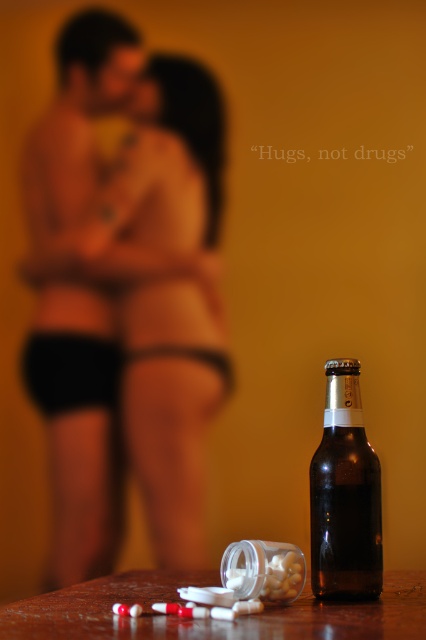
You are a photographer adjusting your camera settings to capture the scene. You notice the matte black man at center and the wooden table at lower center. Which object is positioned higher in the frame?

The matte black man at center is located above the wooden table at lower center, so he is positioned higher in the frame.

You are a photographer standing at a distance of 25 inches from the matte black man at center. Can you capture his face clearly in your photo?

The matte black man at center is 25.64 inches away from the camera. Since you are standing at 25 inches, you are slightly closer than the man, so you can capture his face clearly.

You are holding a camera and want to take a photo of the scene. The camera is currently at a position that is 17.27 inches away from the point labeled as point (351, 625). To ensure the entire scene is in focus, you need to adjust the camera so that it is exactly 20 inches away from this point. How much further do you need to move the camera away from the point to achieve this?

You need to move the camera 2.73 inches further away from the point (351, 625) to reach the desired distance of 20 inches. The current distance is 17.27 inches, so subtracting this from 20 gives the required adjustment.